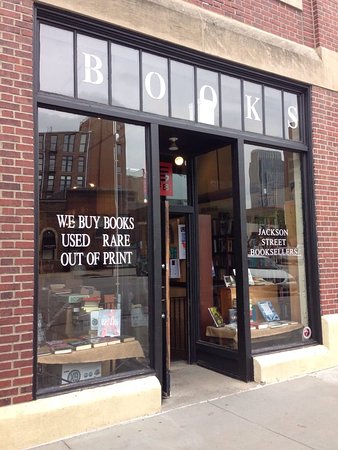
Where is `window border`? This screenshot has width=338, height=450. window border is located at coordinates (297, 4).